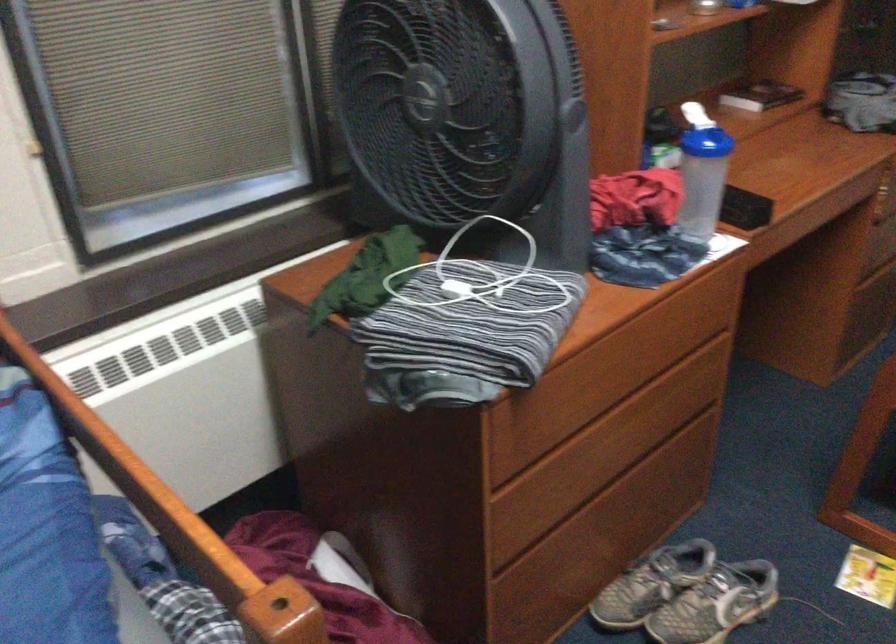
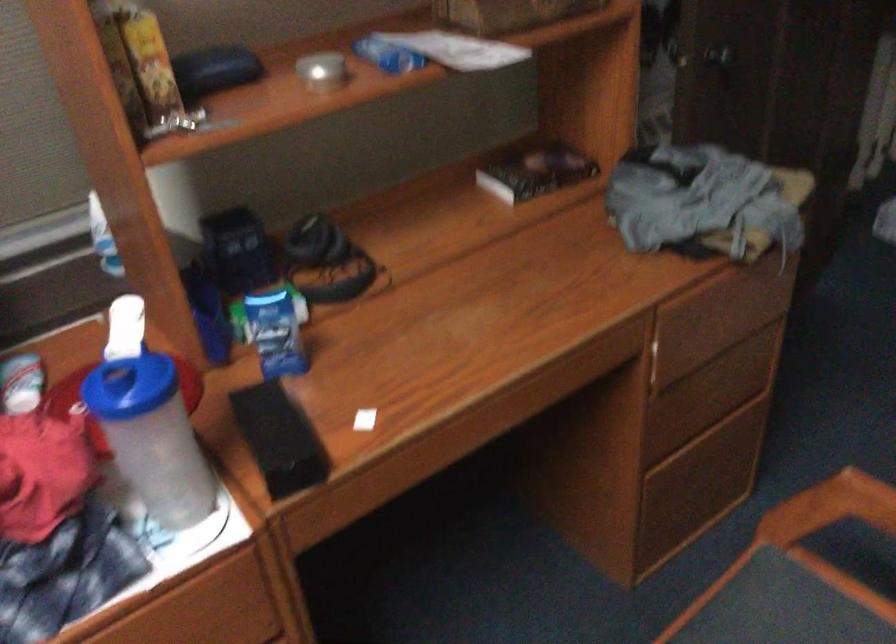
Question: I am providing you with two images of the same scene from different viewpoints. Please identify which objects are invisible in image2.

Choices:
 (A) blue plastic bottle
 (B) blue bottle lid
 (C) yellow cardboard box
 (D) none of these

Answer: (D)